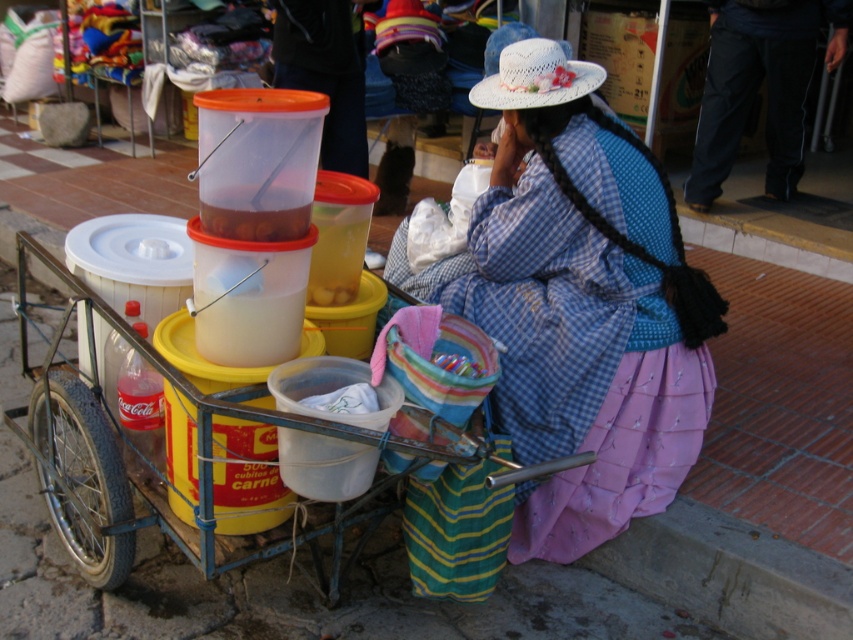
Question: Which point appears closest to the camera in this image?

Choices:
 (A) (509, 132)
 (B) (537, 38)
 (C) (47, 488)

Answer: (B)

Question: From the image, what is the correct spatial relationship of blue plaid dress at center in relation to plastic cart at center?

Choices:
 (A) above
 (B) below

Answer: (A)

Question: Which point is farther to the camera?

Choices:
 (A) [196, 536]
 (B) [582, 84]

Answer: (B)

Question: Is blue plaid dress at center thinner than black cotton pants at lower right?

Choices:
 (A) yes
 (B) no

Answer: (B)

Question: Is plastic cart at center thinner than black cotton pants at lower right?

Choices:
 (A) yes
 (B) no

Answer: (B)

Question: Which object appears farthest from the camera in this image?

Choices:
 (A) blue plaid dress at center
 (B) plastic cart at center
 (C) black cotton pants at lower right
 (D) white woven hat at upper center

Answer: (C)